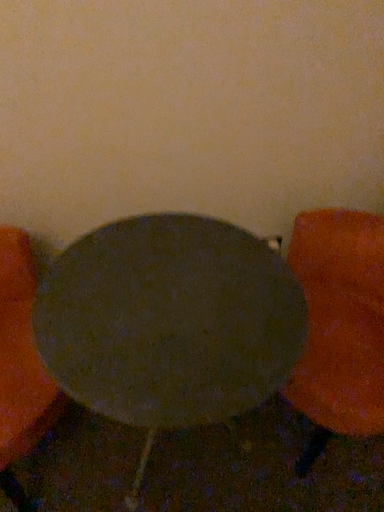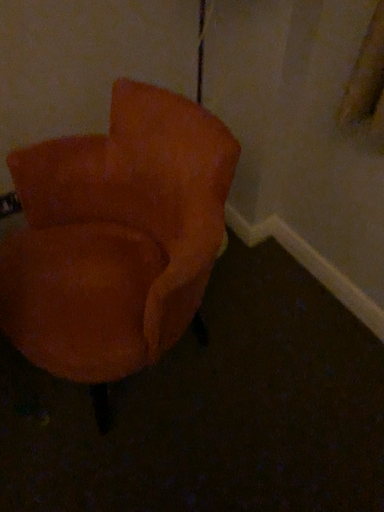
Question: How did the camera likely rotate when shooting the video?

Choices:
 (A) rotated left
 (B) rotated right

Answer: (B)